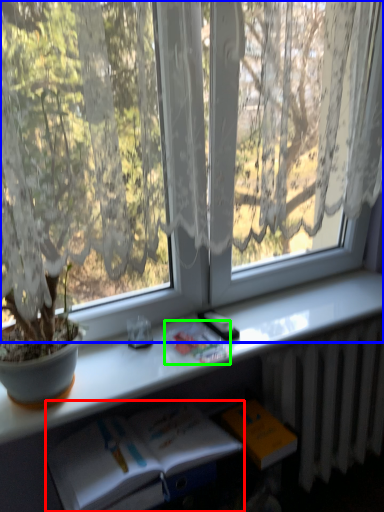
Question: Which is nearer to the book (highlighted by a red box)? window (highlighted by a blue box) or book (highlighted by a green box).

Choices:
 (A) window
 (B) book

Answer: (B)